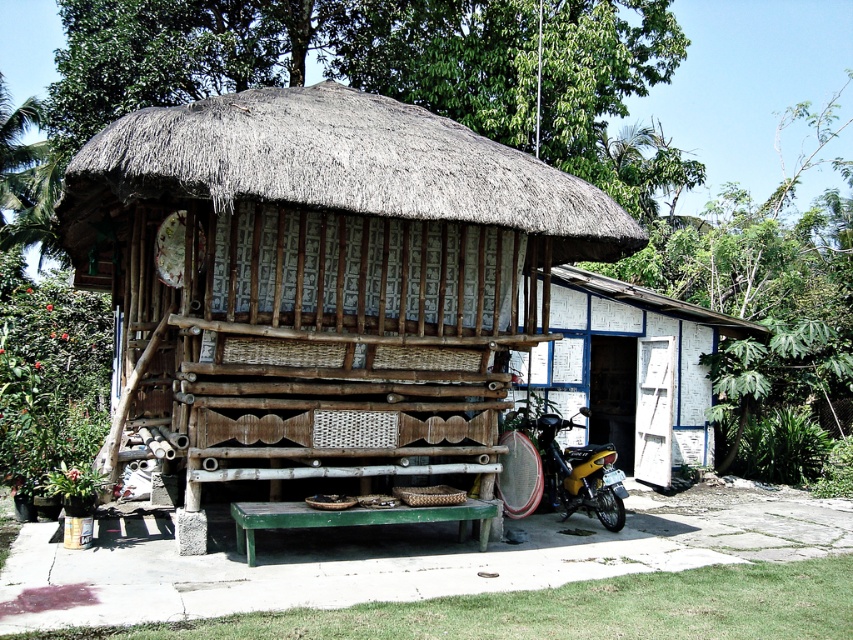
Is brown thatch at center below white painted wood at right?

Incorrect, brown thatch at center is not positioned below white painted wood at right.

Between point (523, 154) and point (640, 474), which one is positioned behind?

The point (640, 474) is more distant.

The image size is (853, 640). I want to click on brown thatch at center, so click(x=337, y=168).

What do you see at coordinates (326, 278) in the screenshot? The width and height of the screenshot is (853, 640). I see `bamboo hut at center` at bounding box center [326, 278].

Is point (157, 410) positioned before point (610, 508)?

That is True.

This screenshot has width=853, height=640. Find the location of `bamboo hut at center`. bamboo hut at center is located at coordinates (326, 278).

What do you see at coordinates (630, 368) in the screenshot?
I see `white painted wood at right` at bounding box center [630, 368].

Is the position of white painted wood at right more distant than that of yellow matte motorcycle at lower right?

Yes, white painted wood at right is further from the viewer.

Identify the location of white painted wood at right. This screenshot has height=640, width=853. (630, 368).